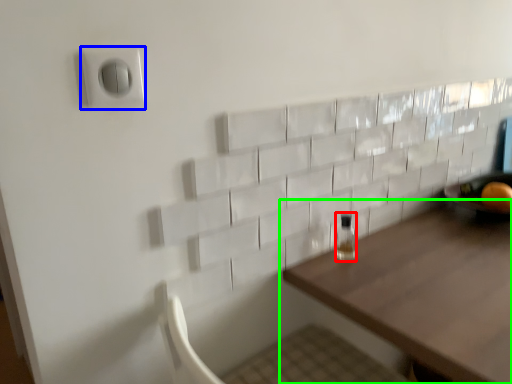
Question: Which object is the closest to the bottle (highlighted by a red box)? Choose among these: electric outlet (highlighted by a blue box) or table (highlighted by a green box).

Choices:
 (A) electric outlet
 (B) table

Answer: (B)